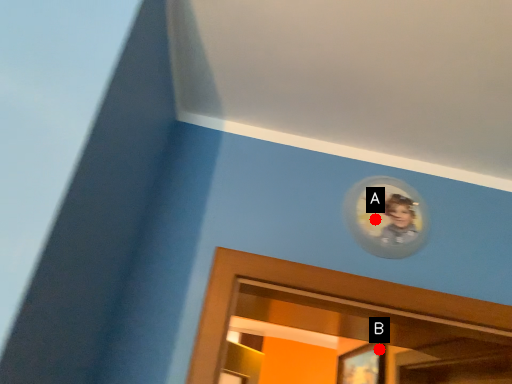
Question: Two points are circled on the image, labeled by A and B beside each circle. Which of the following is the closest to the observer?

Choices:
 (A) A is closer
 (B) B is closer

Answer: (A)